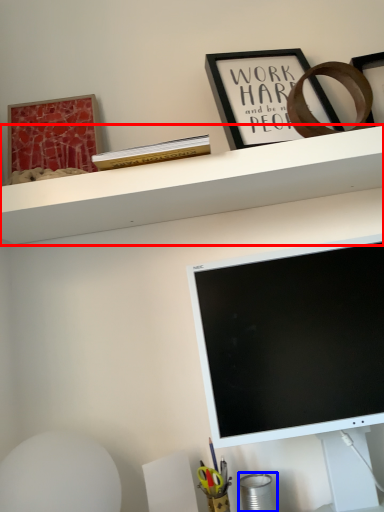
Question: Which point is further to the camera, shelf (highlighted by a red box) or stationery (highlighted by a blue box)?

Choices:
 (A) shelf
 (B) stationery

Answer: (B)